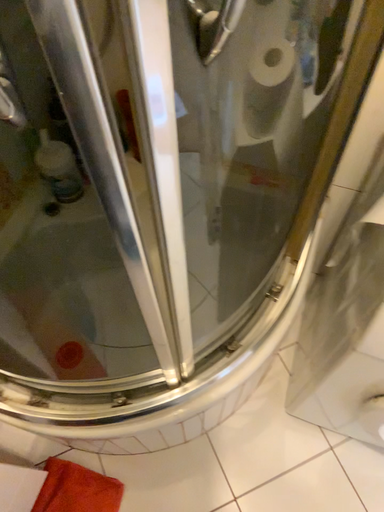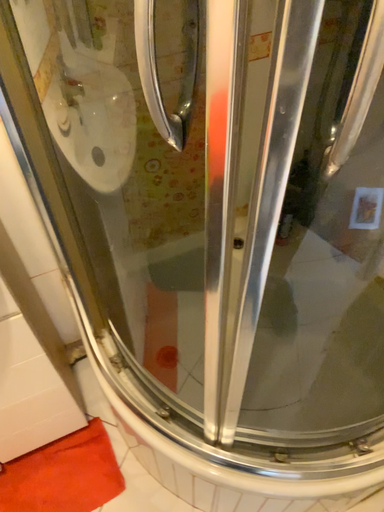
Question: Which way did the camera rotate in the video?

Choices:
 (A) rotated downward
 (B) rotated upward

Answer: (B)